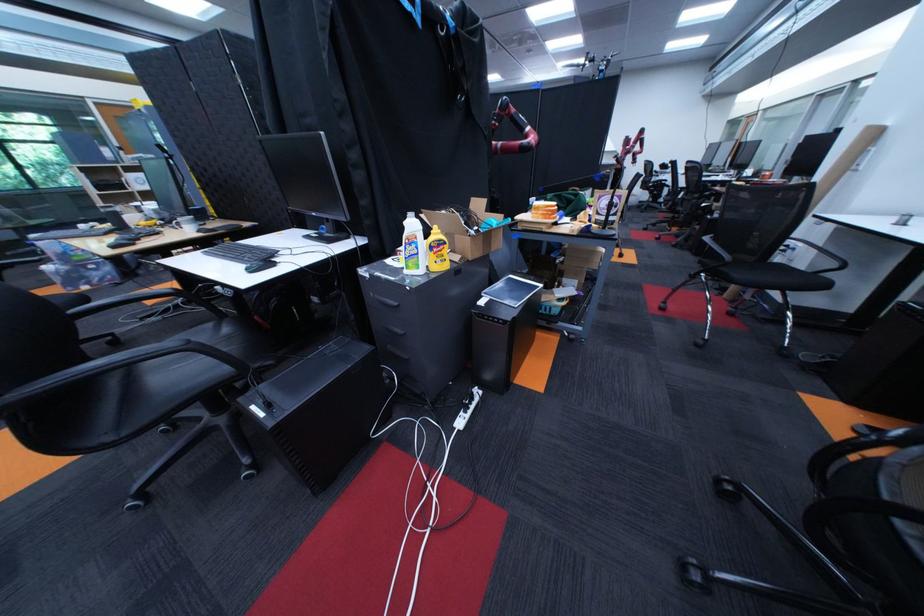
The width and height of the screenshot is (924, 616). I want to click on white ceramic mug, so click(188, 224).